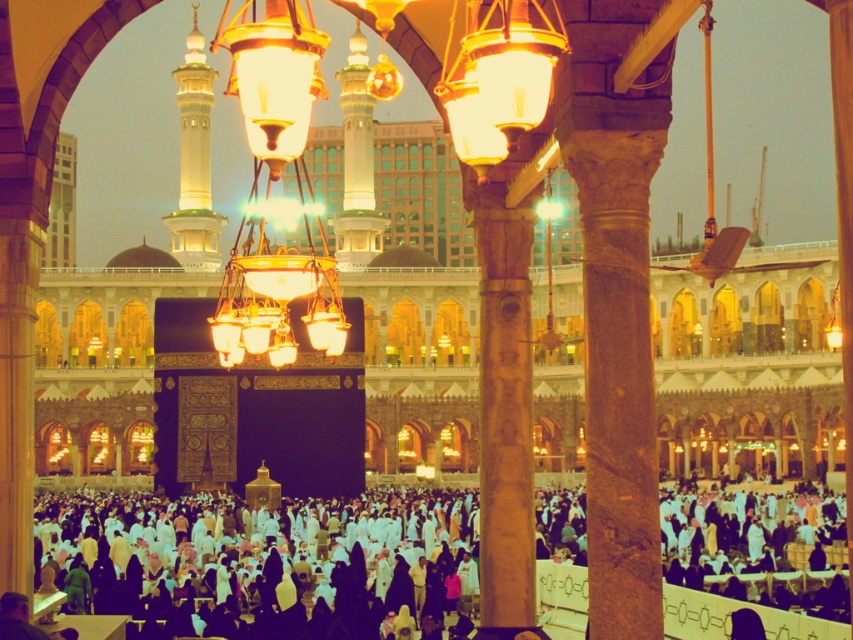
You are a pilgrim standing in the courtyard of the Kaaba. You see the wooden carved column at center and the gold metallic chandelier at center. Which object is located to the right of the other?

The wooden carved column at center is positioned on the right side of the gold metallic chandelier at center, so the wooden carved column at center is to the right of the gold metallic chandelier at center.

You are a photographer standing at the edge of the courtyard. You want to take a photo of the wooden carved column at center without the white matte crowd at center blocking the view. Is the column visible above the crowd?

The wooden carved column at center is taller than the white matte crowd at center, so yes, the column is visible above the crowd.